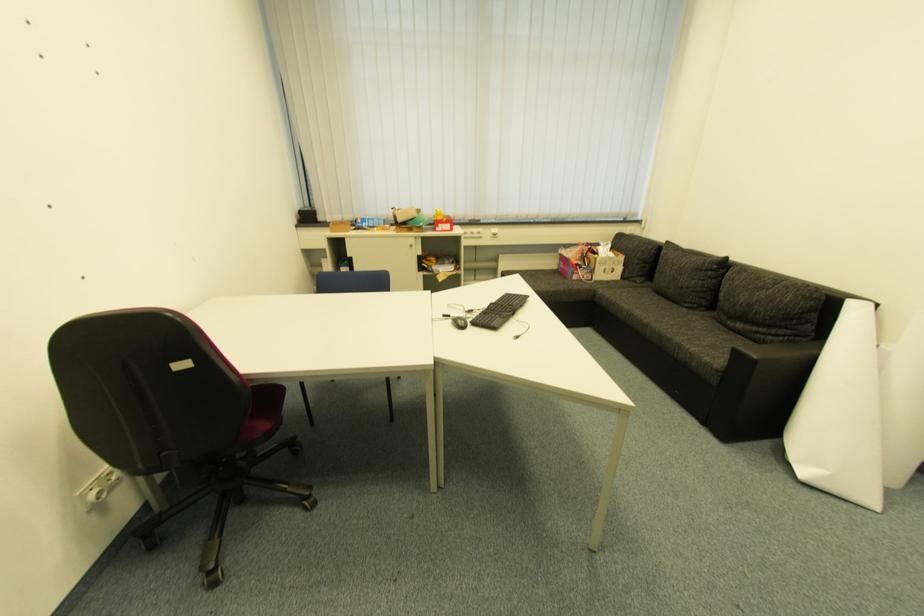
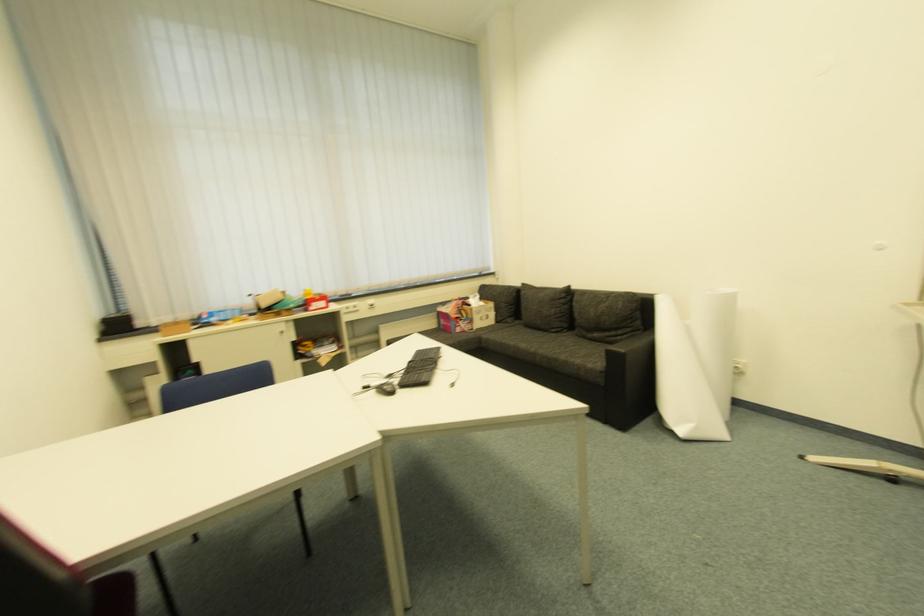
Question: The images are taken continuously from a first-person perspective. In which direction is your viewpoint rotating?

Choices:
 (A) Left
 (B) Right
 (C) Up
 (D) Down

Answer: (B)